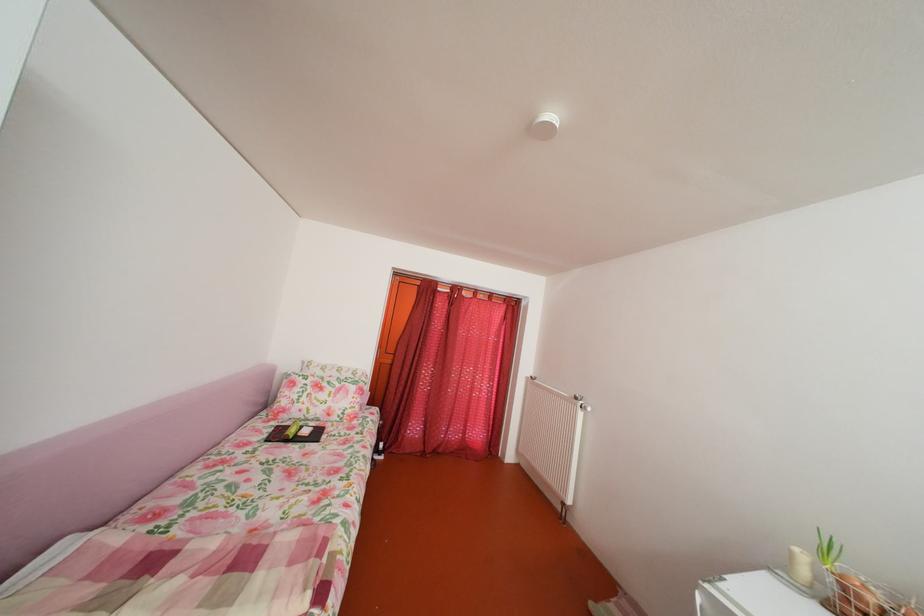
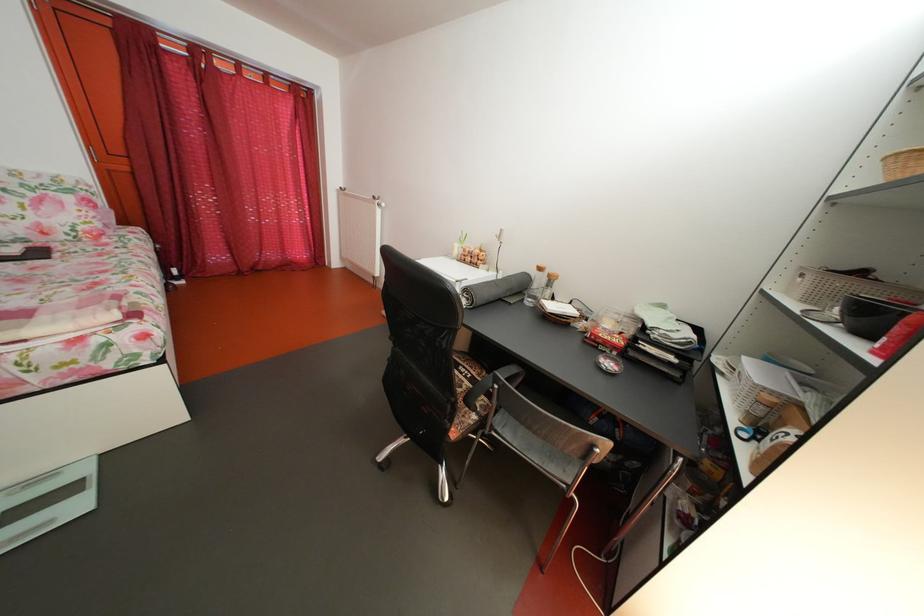
Based on the continuous images, in which direction is the camera rotating?

The rotation direction of the camera is right-down.